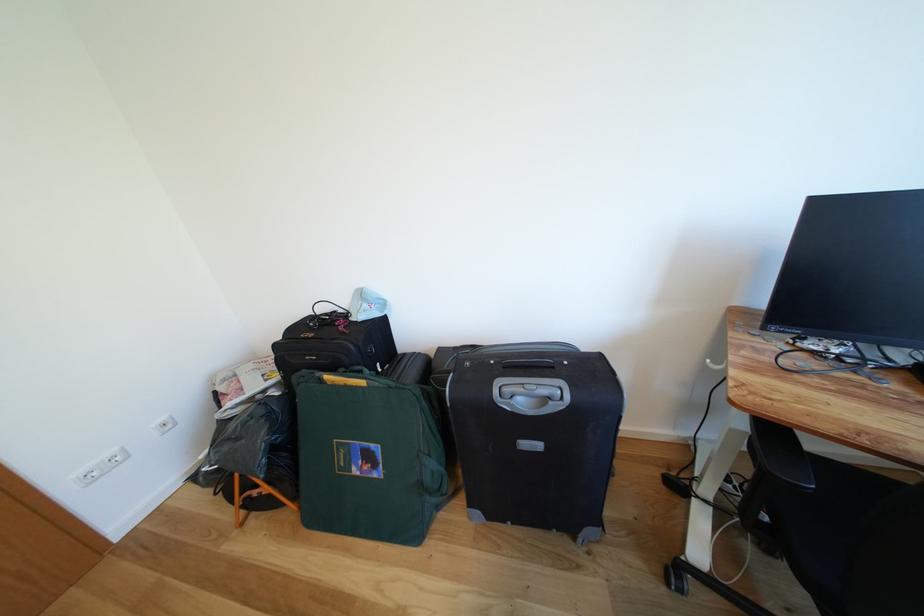
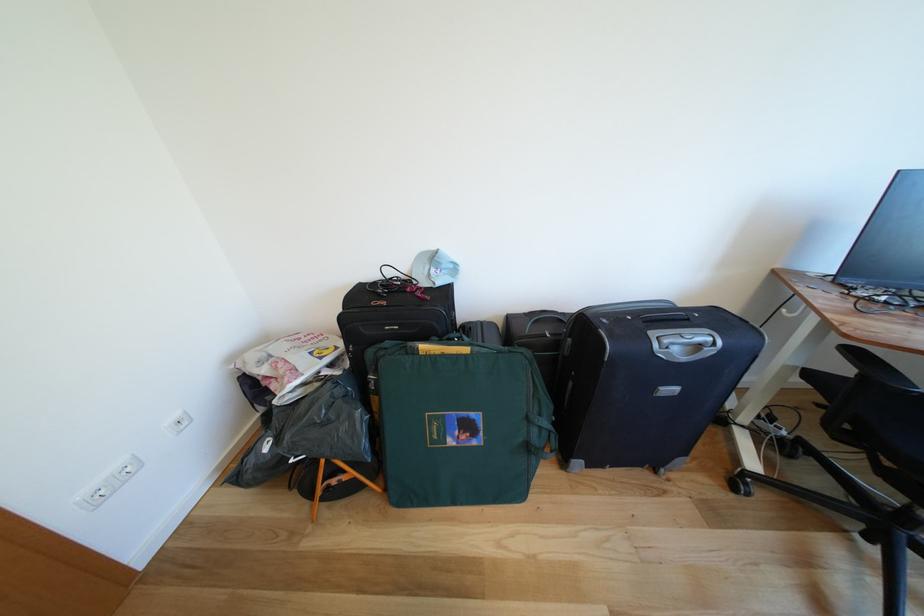
The point at (553, 403) is marked in the first image. Where is the corresponding point in the second image?

(707, 351)